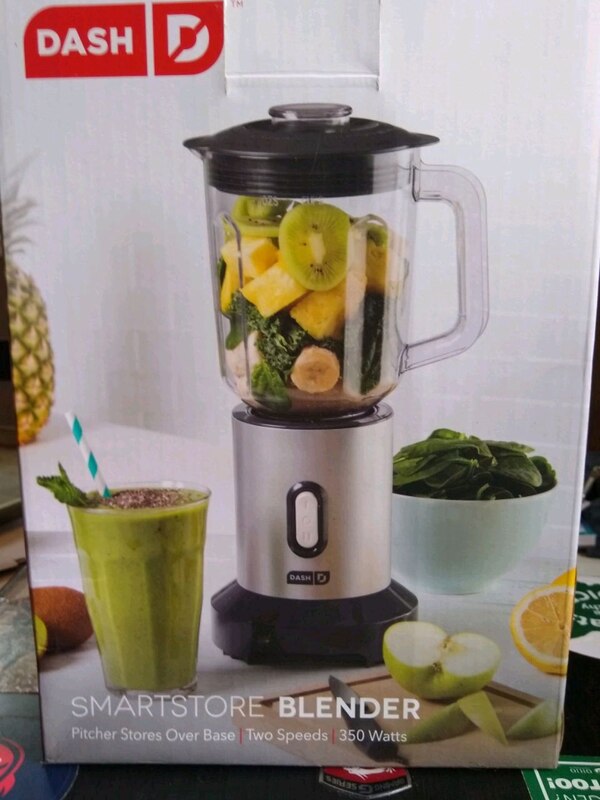
Where is `box`? The image size is (600, 800). box is located at coordinates (538, 94).